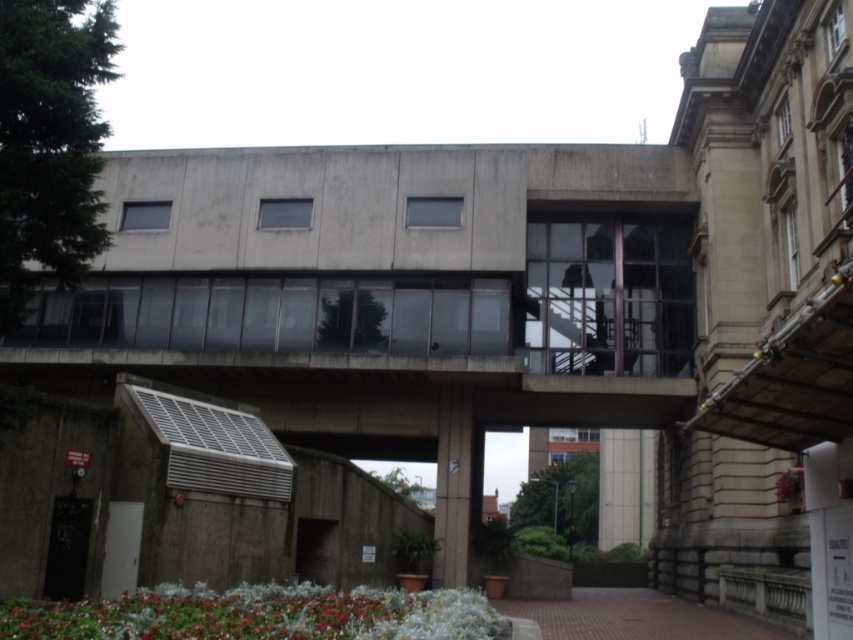
Question: Is concrete at center below green leafy plant at lower center?

Choices:
 (A) no
 (B) yes

Answer: (A)

Question: Which object is positioned closest to the green leafy plant at lower center?

Choices:
 (A) concrete at center
 (B) brown brick path at lower center

Answer: (B)

Question: Which of the following is the farthest from the observer?

Choices:
 (A) green leafy plant at lower center
 (B) concrete at center

Answer: (B)

Question: Estimate the real-world distances between objects in this image. Which object is farther from the brown brick path at lower center?

Choices:
 (A) concrete at center
 (B) green leafy plant at lower center

Answer: (A)

Question: Does green leafy plant at lower center appear over brown brick path at lower center?

Choices:
 (A) no
 (B) yes

Answer: (B)

Question: Observing the image, what is the correct spatial positioning of green leafy plant at lower center in reference to brown brick path at lower center?

Choices:
 (A) left
 (B) right

Answer: (A)